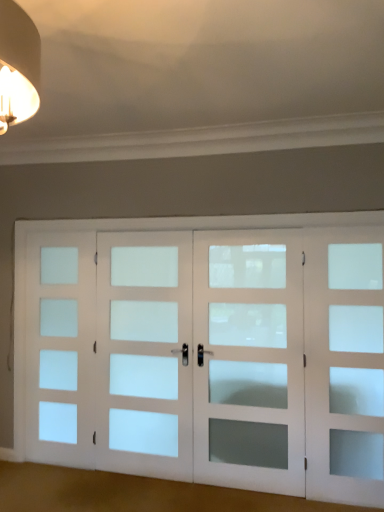
Question: From the image's perspective, relative to satin white glass door at center, the second screen door viewed from the left, is white frosted glass door at right, which is the first screen door in right-to-left order, above or below?

Choices:
 (A) below
 (B) above

Answer: (B)

Question: Would you say white frosted glass door at right, which is counted as the fourth screen door, starting from the left, is inside or outside satin white glass door at center, which is counted as the third screen door, starting from the right?

Choices:
 (A) outside
 (B) inside

Answer: (A)

Question: Estimate the real-world distances between objects in this image. Which object is farther from the white frosted glass door at right, which is the first screen door in right-to-left order?

Choices:
 (A) white frosted glass door at left, which is the fourth screen door from right to left
 (B) white frosted glass door at center, acting as the second screen door starting from the right
 (C) satin white glass door at center, which is counted as the third screen door, starting from the right

Answer: (A)

Question: Which is nearer to the white frosted glass door at left, which is the fourth screen door from right to left?

Choices:
 (A) satin white glass door at center, the second screen door viewed from the left
 (B) white frosted glass door at right, which is the first screen door in right-to-left order
 (C) white frosted glass door at center, the third screen door in the left-to-right sequence

Answer: (A)